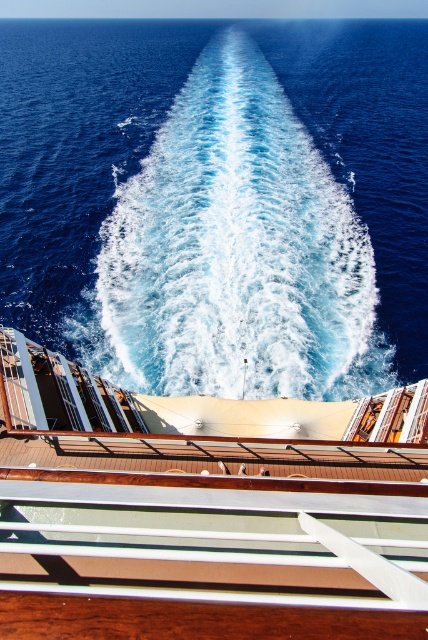
Between point (29, 68) and point (386, 490), which one is positioned behind?

The point (29, 68) is behind.

Can you confirm if blue liquid water at center is positioned to the right of brown wooden deck at center?

Correct, you'll find blue liquid water at center to the right of brown wooden deck at center.

Identify the location of blue liquid water at center. Image resolution: width=428 pixels, height=640 pixels. (219, 200).